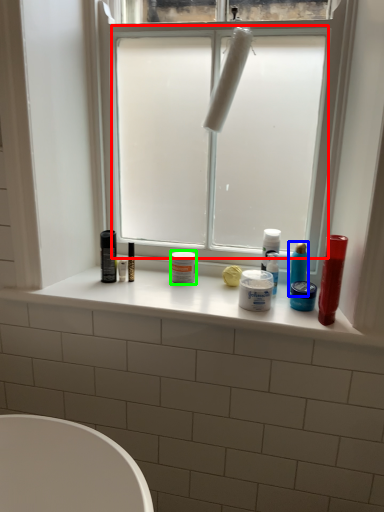
Question: Estimate the real-world distances between objects in this image. Which object is farther from window screen (highlighted by a red box), toiletry (highlighted by a blue box) or toiletry (highlighted by a green box)?

Choices:
 (A) toiletry
 (B) toiletry

Answer: (A)